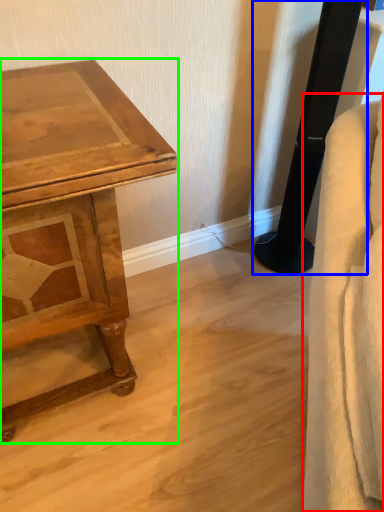
Question: Considering the real-world distances, which object is closest to swivel chair (highlighted by a red box)? pillar (highlighted by a blue box) or table (highlighted by a green box).

Choices:
 (A) pillar
 (B) table

Answer: (B)